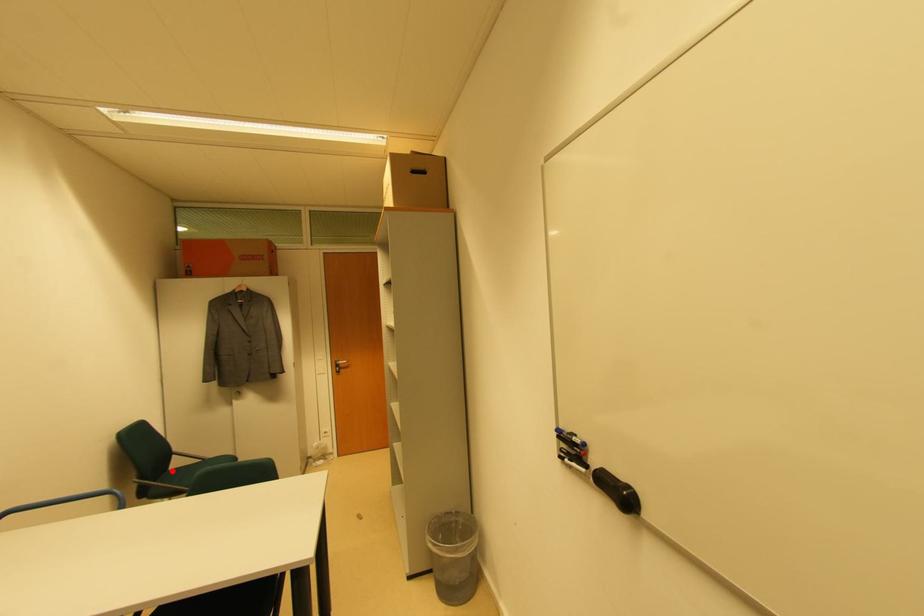
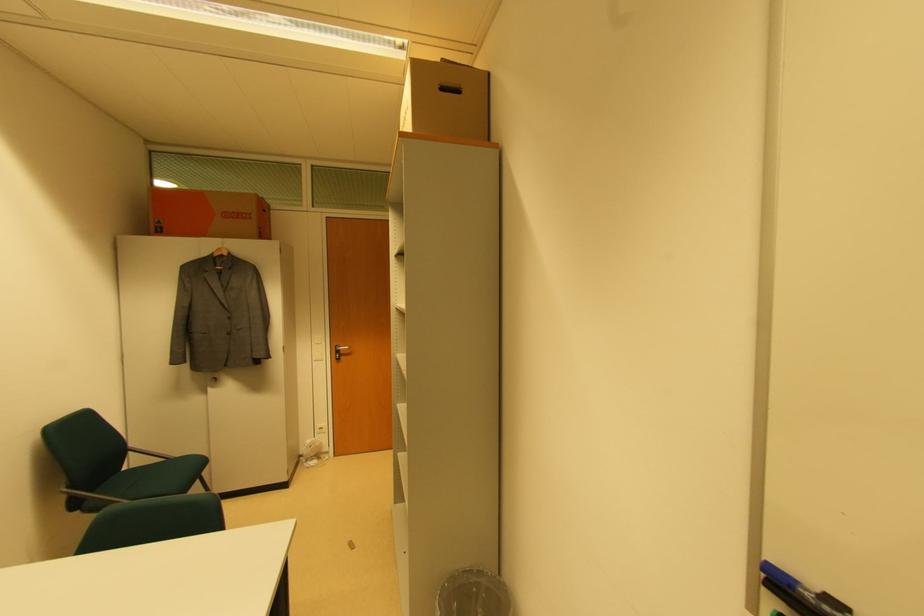
Where in the second image is the point corresponding to the highlighted location from the first image?

(126, 471)